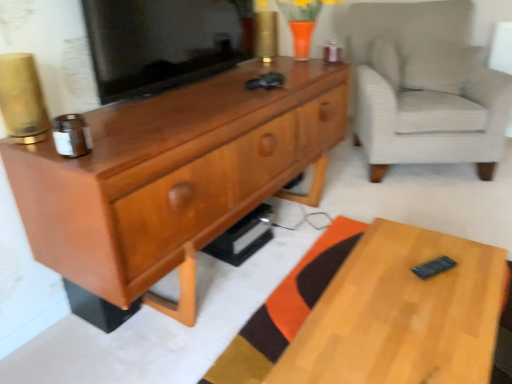
Image resolution: width=512 pixels, height=384 pixels. What are the coordinates of `vacant region below matte black tv at center (from a real-world perspective)` in the screenshot? It's located at (195, 79).